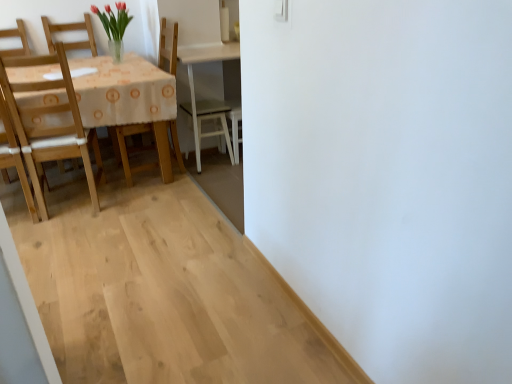
Question: Is wooden chair at left, the 2th chair from the left, completely or partially outside of light wood chair at left, placed as the 1th chair when sorted from left to right?

Choices:
 (A) yes
 (B) no

Answer: (A)

Question: Is wooden chair at left, placed as the first chair when sorted from right to left, shorter than light wood chair at left, which ranks as the 2th chair in right-to-left order?

Choices:
 (A) yes
 (B) no

Answer: (B)

Question: Is light wood chair at left, placed as the 1th chair when sorted from left to right, surrounded by wooden chair at left, placed as the first chair when sorted from right to left?

Choices:
 (A) no
 (B) yes

Answer: (A)

Question: Considering the relative positions of wooden chair at left, placed as the first chair when sorted from right to left, and light wood chair at left, placed as the 1th chair when sorted from left to right, in the image provided, is wooden chair at left, placed as the first chair when sorted from right to left, to the left of light wood chair at left, placed as the 1th chair when sorted from left to right, from the viewer's perspective?

Choices:
 (A) yes
 (B) no

Answer: (B)

Question: From a real-world perspective, is wooden chair at left, placed as the first chair when sorted from right to left, physically above light wood chair at left, placed as the 1th chair when sorted from left to right?

Choices:
 (A) no
 (B) yes

Answer: (B)

Question: Could you tell me if wooden chair at left, placed as the first chair when sorted from right to left, is turned towards light wood chair at left, which ranks as the 2th chair in right-to-left order?

Choices:
 (A) no
 (B) yes

Answer: (B)

Question: From the image's perspective, is light wood chair at left, which ranks as the 2th chair in right-to-left order, over wooden chair at left, placed as the first chair when sorted from right to left?

Choices:
 (A) no
 (B) yes

Answer: (A)

Question: Does light wood chair at left, which ranks as the 2th chair in right-to-left order, have a greater height compared to wooden chair at left, the 2th chair from the left?

Choices:
 (A) no
 (B) yes

Answer: (A)

Question: Considering the relative sizes of light wood chair at left, which ranks as the 2th chair in right-to-left order, and wooden chair at left, the 2th chair from the left, in the image provided, is light wood chair at left, which ranks as the 2th chair in right-to-left order, smaller than wooden chair at left, the 2th chair from the left,?

Choices:
 (A) yes
 (B) no

Answer: (A)

Question: From a real-world perspective, is light wood chair at left, which ranks as the 2th chair in right-to-left order, under wooden chair at left, placed as the first chair when sorted from right to left?

Choices:
 (A) yes
 (B) no

Answer: (A)

Question: Does light wood chair at left, placed as the 1th chair when sorted from left to right, have a greater width compared to wooden chair at left, the 2th chair from the left?

Choices:
 (A) no
 (B) yes

Answer: (B)

Question: Does light wood chair at left, which ranks as the 2th chair in right-to-left order, lie behind wooden chair at left, placed as the first chair when sorted from right to left?

Choices:
 (A) yes
 (B) no

Answer: (B)

Question: In terms of size, does light wood chair at left, which ranks as the 2th chair in right-to-left order, appear bigger or smaller than wooden chair at left, placed as the first chair when sorted from right to left?

Choices:
 (A) small
 (B) big

Answer: (A)